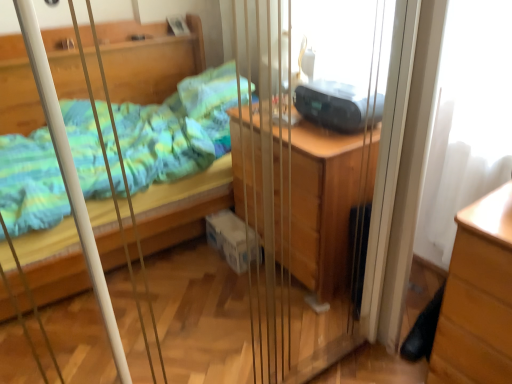
Question: Based on their positions, is light brown wood chest of drawers at lower right located to the left or right of black plastic radio at upper right?

Choices:
 (A) right
 (B) left

Answer: (A)

Question: From their relative heights in the image, would you say light brown wood chest of drawers at lower right is taller or shorter than black plastic radio at upper right?

Choices:
 (A) tall
 (B) short

Answer: (A)

Question: In the image, is light brown wood chest of drawers at lower right positioned in front of or behind black plastic radio at upper right?

Choices:
 (A) behind
 (B) front

Answer: (B)

Question: Based on their positions, is black plastic radio at upper right located to the left or right of light brown wood chest of drawers at lower right?

Choices:
 (A) left
 (B) right

Answer: (A)

Question: In terms of size, does black plastic radio at upper right appear bigger or smaller than light brown wood chest of drawers at lower right?

Choices:
 (A) big
 (B) small

Answer: (B)

Question: Is point (348, 100) closer or farther from the camera than point (459, 236)?

Choices:
 (A) farther
 (B) closer

Answer: (A)

Question: Looking at their shapes, would you say black plastic radio at upper right is wider or thinner than light brown wood chest of drawers at lower right?

Choices:
 (A) thin
 (B) wide

Answer: (A)